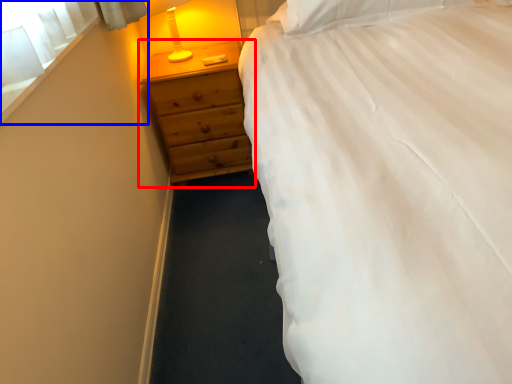
Question: Which object appears farthest to the camera in this image, chest of drawers (highlighted by a red box) or window screen (highlighted by a blue box)?

Choices:
 (A) chest of drawers
 (B) window screen

Answer: (A)